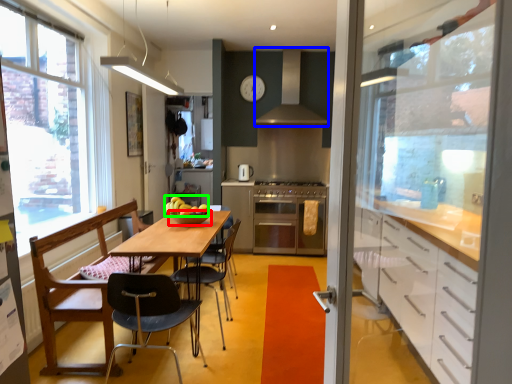
Question: Which is farther away from bowl (highlighted by a red box)? exhaust hood (highlighted by a blue box) or apple (highlighted by a green box)?

Choices:
 (A) exhaust hood
 (B) apple

Answer: (A)